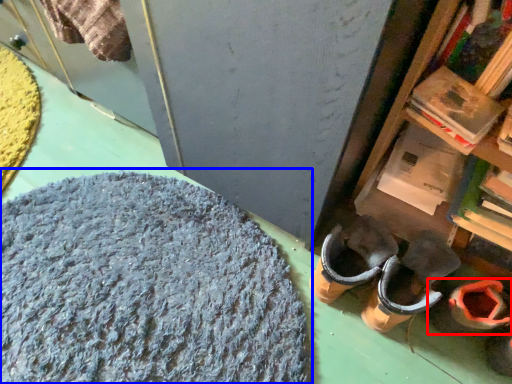
Question: Which object appears closest to the camera in this image, footwear (highlighted by a red box) or wool (highlighted by a blue box)?

Choices:
 (A) footwear
 (B) wool

Answer: (B)